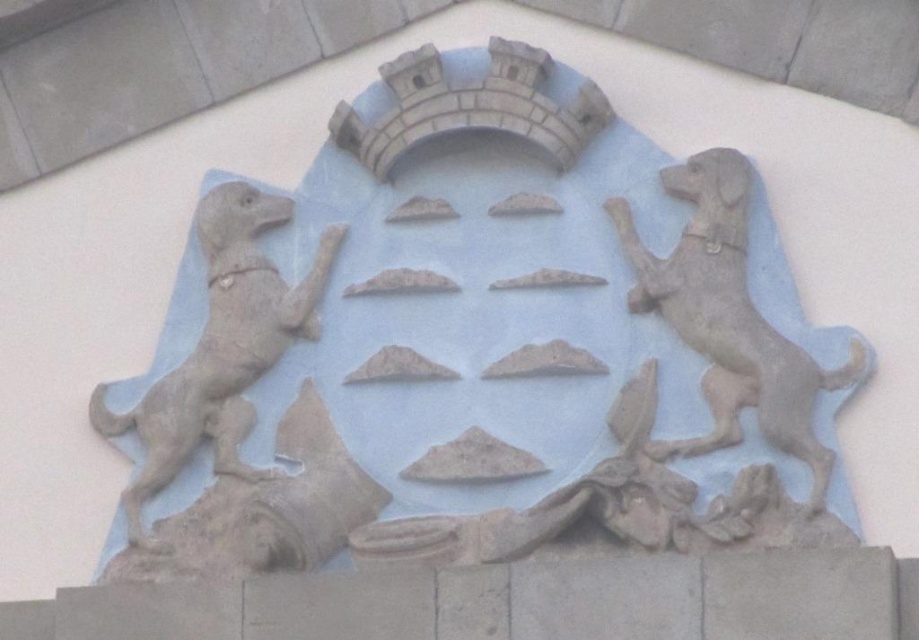
How far apart are stone dogs at center and gray stone dog at right?

4.66 meters

Is point (858, 360) positioned in front of point (815, 468)?

That is False.

Between point (149, 449) and point (725, 284), which one is positioned behind?

Point (149, 449)

I want to click on stone dogs at center, so click(x=479, y=346).

Can you confirm if stone dogs at center is taller than gray stone dog at left?

Indeed, stone dogs at center has a greater height compared to gray stone dog at left.

Who is lower down, stone dogs at center or gray stone dog at left?

Positioned lower is gray stone dog at left.

Is point (720, 349) positioned behind point (138, 500)?

No, (720, 349) is in front of (138, 500).

This screenshot has width=919, height=640. What are the coordinates of `stone dogs at center` in the screenshot? It's located at (479, 346).

Measure the distance between gray stone dog at right and gray stone dog at left.

14.37 meters

Which is behind, point (728, 419) or point (214, 268)?

Positioned behind is point (214, 268).

This screenshot has height=640, width=919. I want to click on gray stone dog at right, so click(x=729, y=317).